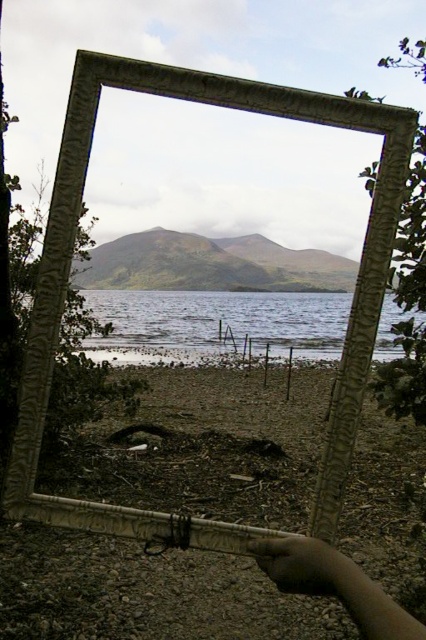
Question: Among these points, which one is nearest to the camera?

Choices:
 (A) 388,627
 (B) 123,298

Answer: (A)

Question: Which point is closer to the camera taking this photo?

Choices:
 (A) (324, 545)
 (B) (150, 317)

Answer: (A)

Question: Can you confirm if clear water at center is positioned to the right of dark skin hand at lower right?

Choices:
 (A) yes
 (B) no

Answer: (A)

Question: Does clear water at center appear over dark skin hand at lower right?

Choices:
 (A) no
 (B) yes

Answer: (B)

Question: Is clear water at center bigger than dark skin hand at lower right?

Choices:
 (A) yes
 (B) no

Answer: (A)